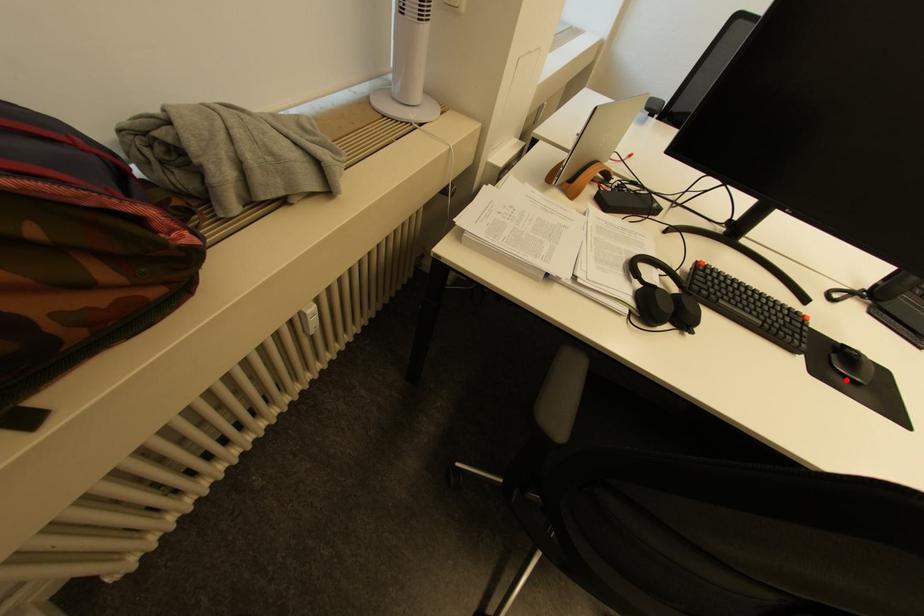
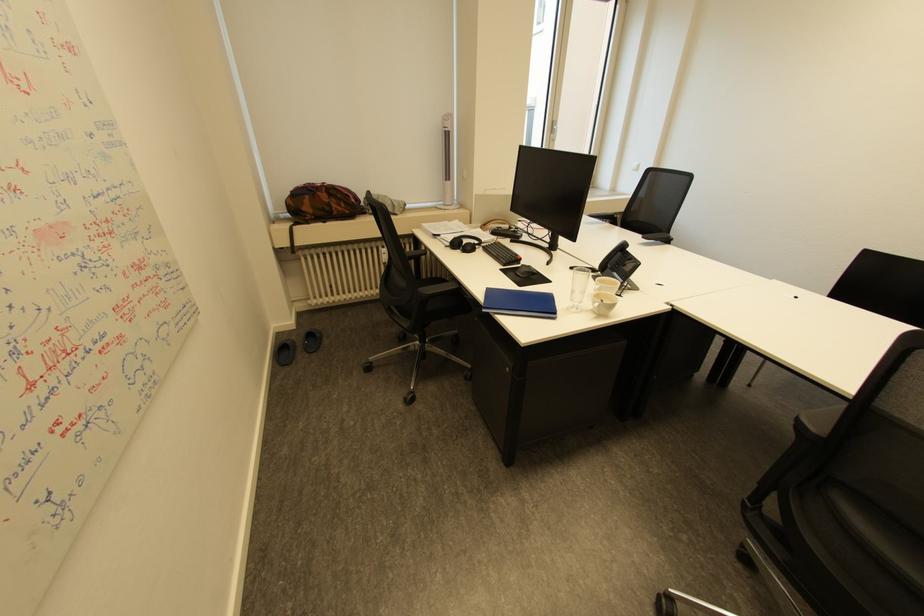
In the second image, find the point that corresponds to the highlighted location in the first image.

(518, 274)